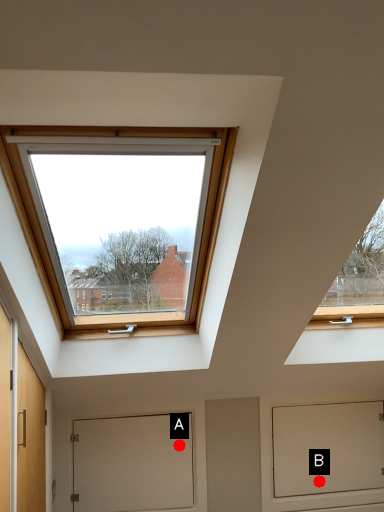
Question: Two points are circled on the image, labeled by A and B beside each circle. Which of the following is the farthest from the observer?

Choices:
 (A) A is further
 (B) B is further

Answer: (B)